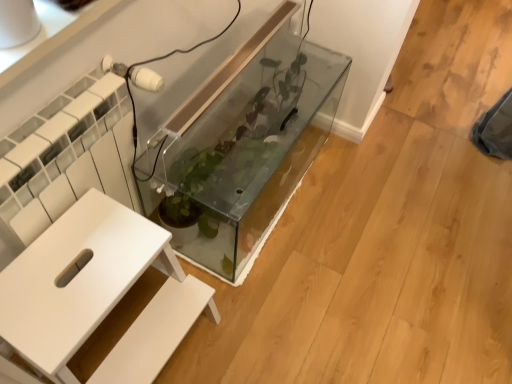
Identify the location of vacant space in front of transparent glass tank at center. (301, 307).